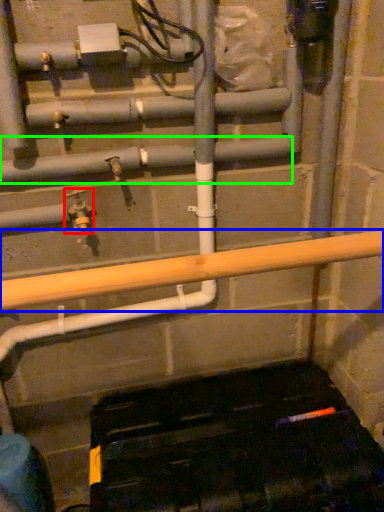
Question: Considering the real-world distances, which object is closest to plumbing fixture (highlighted by a red box)? beam (highlighted by a blue box) or pipe (highlighted by a green box).

Choices:
 (A) beam
 (B) pipe

Answer: (B)